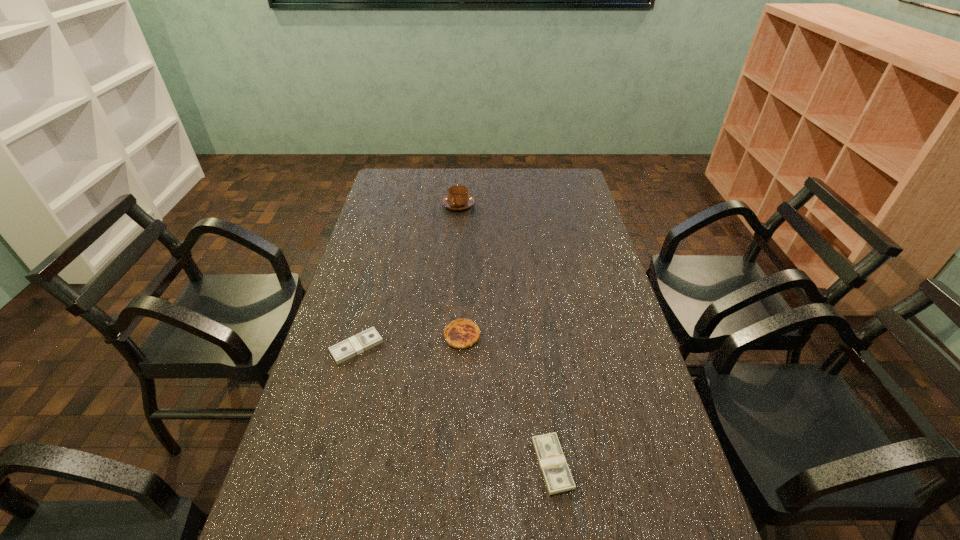
Where is `free space that is in between the leftmost object and the nearest object`? free space that is in between the leftmost object and the nearest object is located at coordinates (455, 405).

You are a GUI agent. You are given a task and a screenshot of the screen. Output one action in this format:
    pyautogui.click(x=<x>, y=<y>)
    Task: Click on the vacant point located between the cappuccino and the rightmost object
    The height and width of the screenshot is (540, 960).
    Given the screenshot: What is the action you would take?
    pyautogui.click(x=506, y=334)

Find the location of a particular element. The height and width of the screenshot is (540, 960). vacant space that's between the leftmost object and the rightmost object is located at coordinates (455, 405).

Locate an element on the screen. The width and height of the screenshot is (960, 540). vacant space that's between the left dollar and the quiche is located at coordinates coord(410,341).

Identify the location of vacant space that's between the leftmost object and the nearer dollar. Image resolution: width=960 pixels, height=540 pixels. (455, 405).

I want to click on free area in between the farther dollar and the third shortest object, so click(x=410, y=341).

Find the location of `object that is the nearest to the cappuccino`. object that is the nearest to the cappuccino is located at coordinates (462, 333).

Where is `object that is the closest one to the cappuccino`? This screenshot has width=960, height=540. object that is the closest one to the cappuccino is located at coordinates (462, 333).

Image resolution: width=960 pixels, height=540 pixels. What are the coordinates of `vacant region that satisfies the following two spatial constraints: 1. on the side of the tallest object with the handle; 2. on the right side of the second tallest object` in the screenshot? It's located at (449, 336).

The width and height of the screenshot is (960, 540). In order to click on blank space that satisfies the following two spatial constraints: 1. on the side of the third shortest object with the handle; 2. on the right side of the tallest object in this screenshot , I will do `click(449, 336)`.